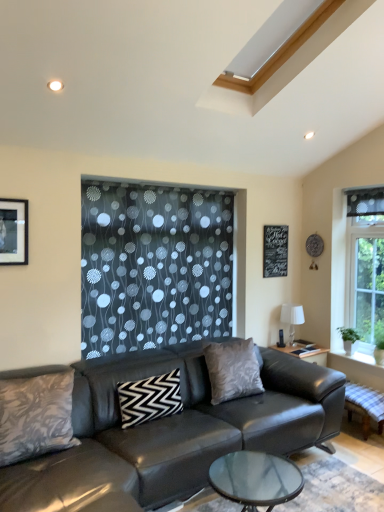
Question: Considering the relative positions of white fabric lampshade at right and black zigzag pillow at center, which is counted as the 2th pillow, starting from the front, in the image provided, is white fabric lampshade at right to the right of black zigzag pillow at center, which is counted as the 2th pillow, starting from the front, from the viewer's perspective?

Choices:
 (A) no
 (B) yes

Answer: (B)

Question: From a real-world perspective, does white fabric lampshade at right stand above black zigzag pillow at center, which is counted as the 2th pillow, starting from the front?

Choices:
 (A) yes
 (B) no

Answer: (A)

Question: Is white fabric lampshade at right facing away from black zigzag pillow at center, which is the second pillow in left-to-right order?

Choices:
 (A) yes
 (B) no

Answer: (B)

Question: Is white fabric lampshade at right wider than black zigzag pillow at center, which is counted as the 2th pillow, starting from the front?

Choices:
 (A) no
 (B) yes

Answer: (B)

Question: Considering the relative sizes of white fabric lampshade at right and black zigzag pillow at center, which is counted as the 2th pillow, starting from the front, in the image provided, is white fabric lampshade at right taller than black zigzag pillow at center, which is counted as the 2th pillow, starting from the front,?

Choices:
 (A) no
 (B) yes

Answer: (B)

Question: Considering the relative sizes of white fabric lampshade at right and black zigzag pillow at center, which is the second pillow in left-to-right order, in the image provided, is white fabric lampshade at right thinner than black zigzag pillow at center, which is the second pillow in left-to-right order,?

Choices:
 (A) yes
 (B) no

Answer: (B)

Question: Is textured gray pillow at lower left, the first pillow from the front, at the right side of silky gray pillow at center, placed as the 3th pillow when sorted from left to right?

Choices:
 (A) no
 (B) yes

Answer: (A)

Question: Does textured gray pillow at lower left, the first pillow from the front, touch silky gray pillow at center, which is counted as the 3th pillow, starting from the front?

Choices:
 (A) no
 (B) yes

Answer: (A)

Question: Is textured gray pillow at lower left, the first pillow from the front, far away from silky gray pillow at center, the first pillow when ordered from right to left?

Choices:
 (A) no
 (B) yes

Answer: (B)

Question: Considering the relative sizes of textured gray pillow at lower left, which is counted as the third pillow, starting from the back, and silky gray pillow at center, the first pillow when ordered from right to left, in the image provided, is textured gray pillow at lower left, which is counted as the third pillow, starting from the back, taller than silky gray pillow at center, the first pillow when ordered from right to left,?

Choices:
 (A) yes
 (B) no

Answer: (A)

Question: Is textured gray pillow at lower left, placed as the 1th pillow when sorted from left to right, facing away from silky gray pillow at center, placed as the 3th pillow when sorted from left to right?

Choices:
 (A) no
 (B) yes

Answer: (A)

Question: From a real-world perspective, is textured gray pillow at lower left, marked as the third pillow in a right-to-left arrangement, over silky gray pillow at center, placed as the 3th pillow when sorted from left to right?

Choices:
 (A) yes
 (B) no

Answer: (B)

Question: Is matte black picture frame at upper left not close to black zigzag pillow at center, which is the second pillow in left-to-right order?

Choices:
 (A) no
 (B) yes

Answer: (B)